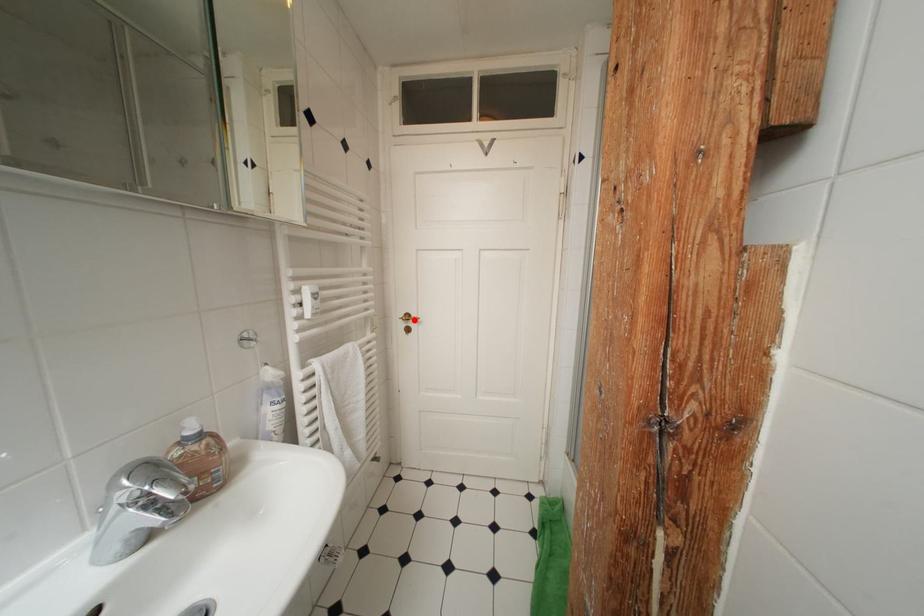
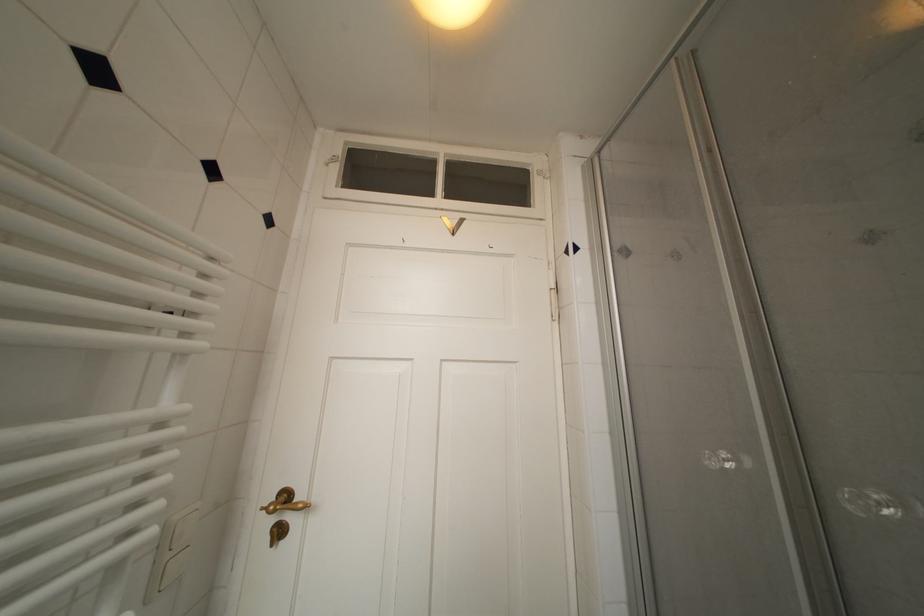
Locate, in the second image, the point that corresponds to the highlighted location in the first image.

(293, 500)